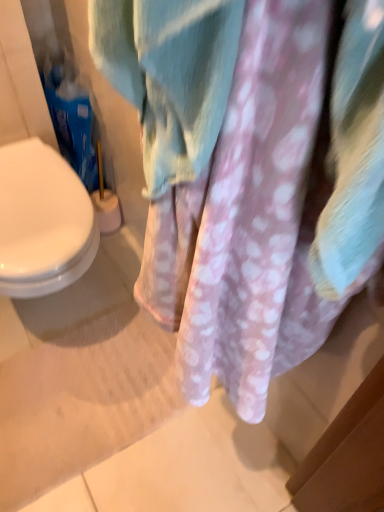
Question: Is white plastic brush at lower left located within pink fuzzy towel at center?

Choices:
 (A) yes
 (B) no

Answer: (B)

Question: Is pink fuzzy towel at center facing away from white plastic brush at lower left?

Choices:
 (A) yes
 (B) no

Answer: (B)

Question: Is pink fuzzy towel at center oriented towards white plastic brush at lower left?

Choices:
 (A) no
 (B) yes

Answer: (A)

Question: Can you confirm if pink fuzzy towel at center is bigger than white plastic brush at lower left?

Choices:
 (A) no
 (B) yes

Answer: (B)

Question: From a real-world perspective, does pink fuzzy towel at center sit lower than white plastic brush at lower left?

Choices:
 (A) yes
 (B) no

Answer: (B)

Question: Does pink fuzzy towel at center have a smaller size compared to white plastic brush at lower left?

Choices:
 (A) no
 (B) yes

Answer: (A)

Question: Is pink fuzzy towel at center a part of white plastic brush at lower left?

Choices:
 (A) yes
 (B) no

Answer: (B)

Question: Can you confirm if white plastic brush at lower left is thinner than pink fuzzy towel at center?

Choices:
 (A) yes
 (B) no

Answer: (B)

Question: Would you say white plastic brush at lower left is outside pink fuzzy towel at center?

Choices:
 (A) yes
 (B) no

Answer: (A)

Question: Is white plastic brush at lower left at the right side of pink fuzzy towel at center?

Choices:
 (A) no
 (B) yes

Answer: (A)

Question: Does white plastic brush at lower left lie behind pink fuzzy towel at center?

Choices:
 (A) no
 (B) yes

Answer: (B)

Question: Considering the relative sizes of white plastic brush at lower left and pink fuzzy towel at center in the image provided, is white plastic brush at lower left smaller than pink fuzzy towel at center?

Choices:
 (A) yes
 (B) no

Answer: (A)

Question: In terms of size, does white plastic brush at lower left appear bigger or smaller than pink fuzzy towel at center?

Choices:
 (A) big
 (B) small

Answer: (B)